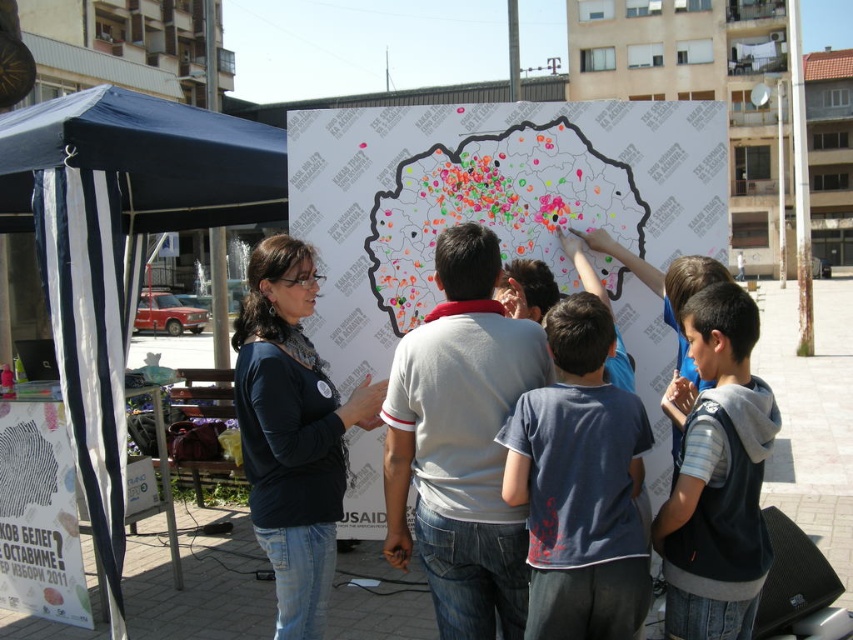
Can you confirm if blue fabric canopy at upper left is positioned to the right of gray hoodie at right?

No, blue fabric canopy at upper left is not to the right of gray hoodie at right.

Does blue fabric canopy at upper left appear under gray hoodie at right?

No.

What do you see at coordinates (146, 160) in the screenshot? This screenshot has width=853, height=640. I see `blue fabric canopy at upper left` at bounding box center [146, 160].

Locate an element on the screen. blue fabric canopy at upper left is located at coordinates (146, 160).

Measure the distance between point (x=648, y=321) and camera.

Point (x=648, y=321) and camera are 3.61 meters apart.

Is point (579, 152) less distant than point (265, 211)?

Yes.

Between point (439, 298) and point (122, 108), which one is positioned in front?

Point (439, 298) is more forward.

What are the coordinates of `white paper map at center` in the screenshot? It's located at (488, 198).

Which is behind, point (265, 212) or point (49, 445)?

Positioned behind is point (265, 212).

Between point (267, 195) and point (32, 490), which one is positioned behind?

The point (267, 195) is more distant.

Find the location of a particular element. This screenshot has width=853, height=640. blue fabric canopy at upper left is located at coordinates (146, 160).